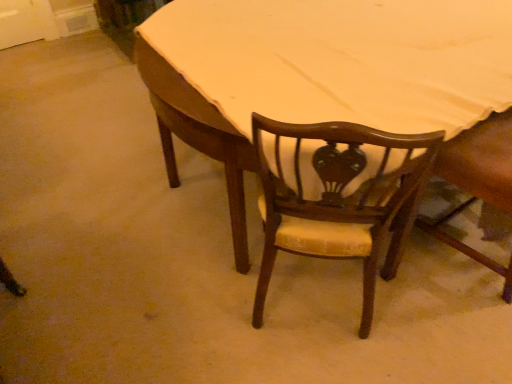
Question: From the image's perspective, is wooden table at center above wooden chair at center, marked as the 2th chair in a left-to-right arrangement?

Choices:
 (A) yes
 (B) no

Answer: (A)

Question: From a real-world perspective, does wooden table at center stand above wooden chair at center, the first chair viewed from the right?

Choices:
 (A) yes
 (B) no

Answer: (B)

Question: Is wooden table at center thinner than wooden chair at center, marked as the 2th chair in a left-to-right arrangement?

Choices:
 (A) yes
 (B) no

Answer: (B)

Question: Is wooden table at center taller than wooden chair at center, the first chair viewed from the right?

Choices:
 (A) no
 (B) yes

Answer: (A)

Question: Can we say wooden table at center lies outside wooden chair at center, the first chair viewed from the right?

Choices:
 (A) no
 (B) yes

Answer: (B)

Question: Is wooden chair at center, marked as the 2th chair in a left-to-right arrangement, wider or thinner than wooden table at center?

Choices:
 (A) thin
 (B) wide

Answer: (A)

Question: Considering the positions of wooden chair at center, the first chair viewed from the right, and wooden table at center in the image, is wooden chair at center, the first chair viewed from the right, taller or shorter than wooden table at center?

Choices:
 (A) tall
 (B) short

Answer: (A)

Question: Is point (440, 218) closer or farther from the camera than point (374, 54)?

Choices:
 (A) closer
 (B) farther

Answer: (B)

Question: From a real-world perspective, is wooden chair at center, marked as the 2th chair in a left-to-right arrangement, physically located above or below wooden table at center?

Choices:
 (A) above
 (B) below

Answer: (A)

Question: In the image, is wooden chair at center, which is the second chair from right to left, positioned in front of or behind wooden chair at center, marked as the 2th chair in a left-to-right arrangement?

Choices:
 (A) front
 (B) behind

Answer: (A)

Question: From the image's perspective, is wooden chair at center, positioned as the 1th chair in left-to-right order, located above or below wooden chair at center, the first chair viewed from the right?

Choices:
 (A) above
 (B) below

Answer: (B)

Question: Considering the positions of wooden chair at center, which is the second chair from right to left, and wooden chair at center, the first chair viewed from the right, in the image, is wooden chair at center, which is the second chair from right to left, wider or thinner than wooden chair at center, the first chair viewed from the right,?

Choices:
 (A) wide
 (B) thin

Answer: (B)

Question: From a real-world perspective, is wooden chair at center, positioned as the 1th chair in left-to-right order, physically located above or below wooden chair at center, the first chair viewed from the right?

Choices:
 (A) below
 (B) above

Answer: (A)

Question: Looking at their shapes, would you say wooden chair at center, marked as the 2th chair in a left-to-right arrangement, is wider or thinner than wooden chair at center, which is the second chair from right to left?

Choices:
 (A) thin
 (B) wide

Answer: (B)

Question: From their relative heights in the image, would you say wooden chair at center, the first chair viewed from the right, is taller or shorter than wooden chair at center, which is the second chair from right to left?

Choices:
 (A) tall
 (B) short

Answer: (A)